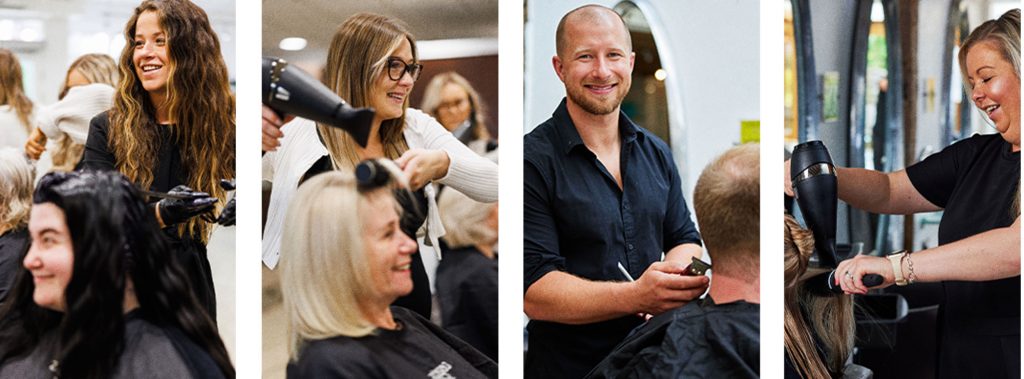
The height and width of the screenshot is (379, 1024). I want to click on round mirrors, so click(794, 97), click(871, 95), click(952, 96), click(653, 92).